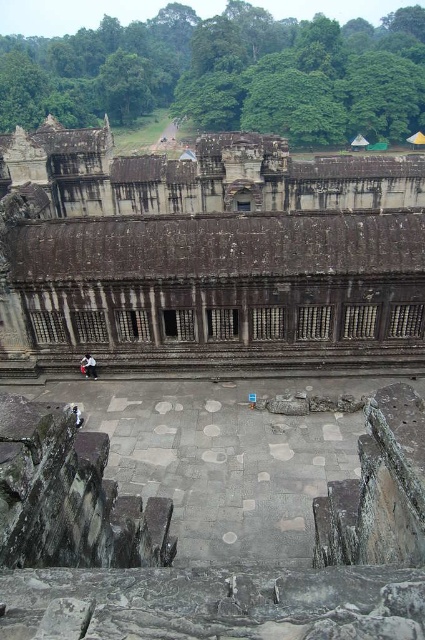
Question: Which of the following is the closest to the observer?

Choices:
 (A) white cotton shirt at center
 (B) weathered stone ruins at center

Answer: (B)

Question: Can you confirm if weathered stone ruins at center is positioned below white cotton shirt at center?

Choices:
 (A) no
 (B) yes

Answer: (A)

Question: Which point is farther to the camera?

Choices:
 (A) (326, 259)
 (B) (95, 365)

Answer: (B)

Question: Can you confirm if weathered stone ruins at center is positioned to the right of white cotton shirt at center?

Choices:
 (A) yes
 (B) no

Answer: (A)

Question: Can you confirm if weathered stone ruins at center is positioned to the left of white cotton shirt at center?

Choices:
 (A) yes
 (B) no

Answer: (B)